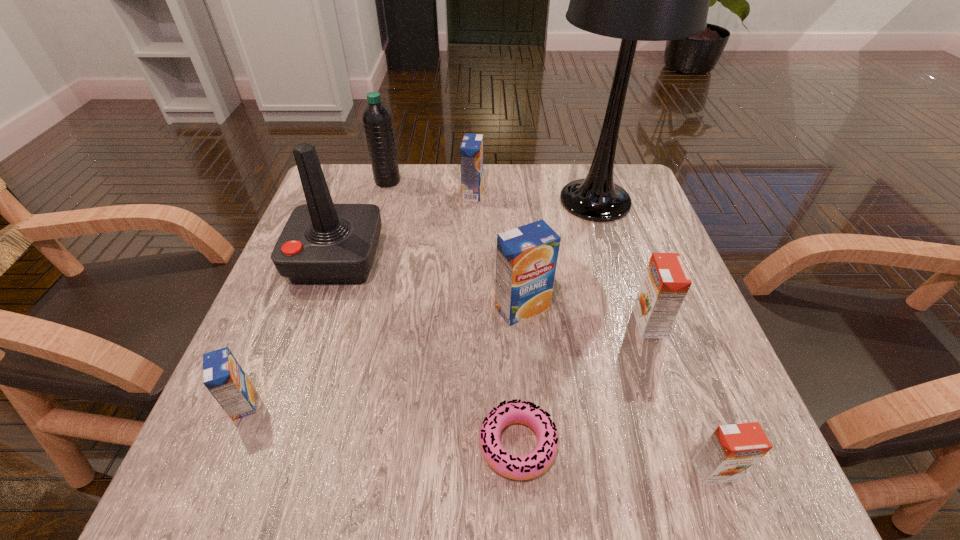
This screenshot has width=960, height=540. I want to click on the leftmost blue orange_juice, so click(x=222, y=375).

Image resolution: width=960 pixels, height=540 pixels. What are the coordinates of `the nearest orange juice` in the screenshot? It's located at (732, 450).

This screenshot has height=540, width=960. I want to click on the nearer orange orange juice, so [732, 450].

Locate an element on the screen. The image size is (960, 540). pink doughnut is located at coordinates (532, 465).

Locate an element on the screen. The image size is (960, 540). doughnut is located at coordinates pyautogui.click(x=532, y=465).

I want to click on free space located on the left of the tallest object, so click(423, 201).

This screenshot has width=960, height=540. I want to click on free space located 0.290m on the right of the joystick, so click(516, 259).

The height and width of the screenshot is (540, 960). I want to click on free region located 0.100m on the right of the black water bottle, so click(439, 181).

Where is `free space located on the back of the biggest blue orange_juice`? free space located on the back of the biggest blue orange_juice is located at coordinates (511, 185).

You are a GUI agent. You are given a task and a screenshot of the screen. Output one action in this format:
    pyautogui.click(x=<x>, y=<y>)
    Task: Click on the vacant space located 0.230m on the front of the farther orange orange juice
    The width and height of the screenshot is (960, 540).
    Given the screenshot: What is the action you would take?
    (x=699, y=467)